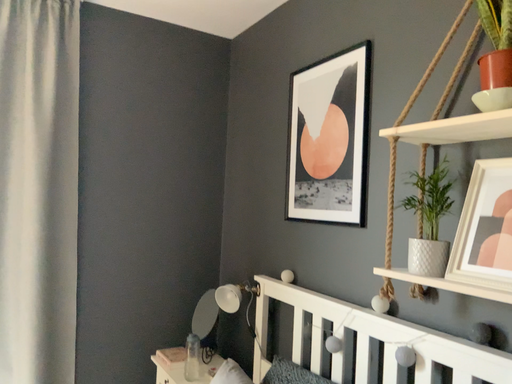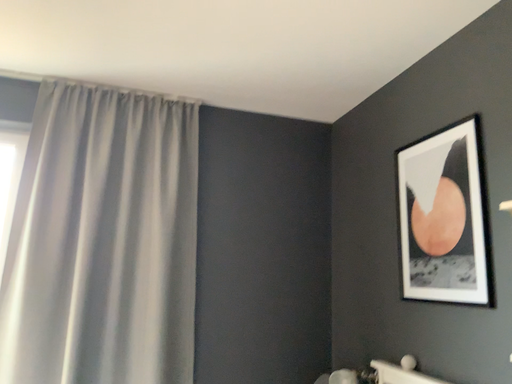
Question: How did the camera likely rotate when shooting the video?

Choices:
 (A) rotated upward
 (B) rotated downward

Answer: (A)